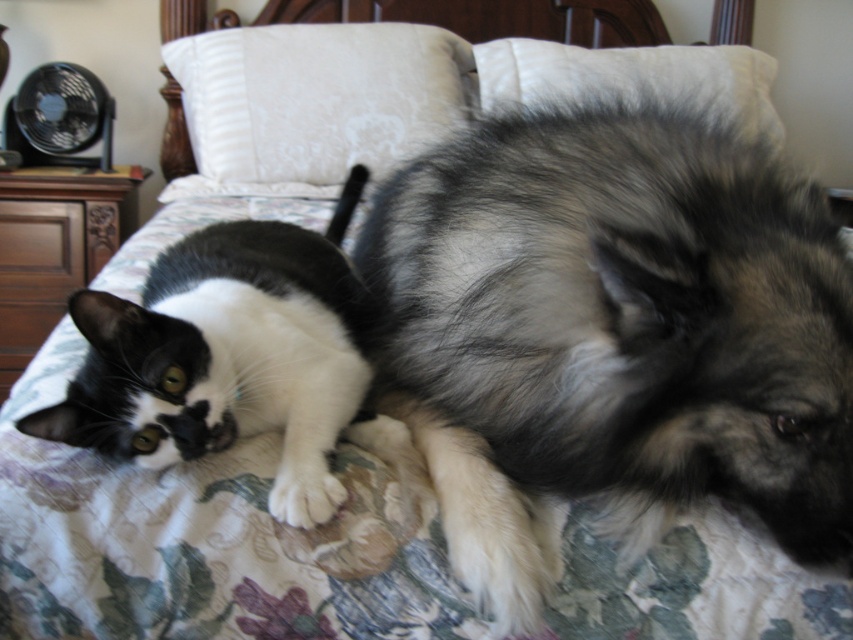
Does black and white fur cat at center appear under white textured pillow at upper center?

Indeed, black and white fur cat at center is positioned under white textured pillow at upper center.

In the scene shown: Is black and white fur cat at center above white textured pillow at upper center?

No, black and white fur cat at center is not above white textured pillow at upper center.

Measure the distance between black and white fur cat at center and camera.

The distance of black and white fur cat at center from camera is 26.52 inches.

Locate an element on the screen. This screenshot has height=640, width=853. black and white fur cat at center is located at coordinates (227, 355).

Can you confirm if gray fluffy dog at center is bigger than white textured pillow at upper center?

Actually, gray fluffy dog at center might be smaller than white textured pillow at upper center.

Where is `gray fluffy dog at center`? The width and height of the screenshot is (853, 640). gray fluffy dog at center is located at coordinates (612, 333).

Between gray fluffy dog at center and white damask pillow at upper center, which one is positioned lower?

gray fluffy dog at center

Based on the photo, between gray fluffy dog at center and white damask pillow at upper center, which one has more height?

white damask pillow at upper center is taller.

Which is behind, point (463, 332) or point (318, 180)?

Positioned behind is point (318, 180).

Identify the location of gray fluffy dog at center. The image size is (853, 640). (612, 333).